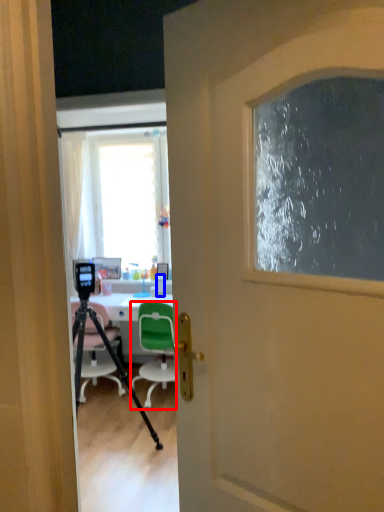
Question: Which point is closer to the camera, chair (highlighted by a red box) or bottle (highlighted by a blue box)?

Choices:
 (A) chair
 (B) bottle

Answer: (A)